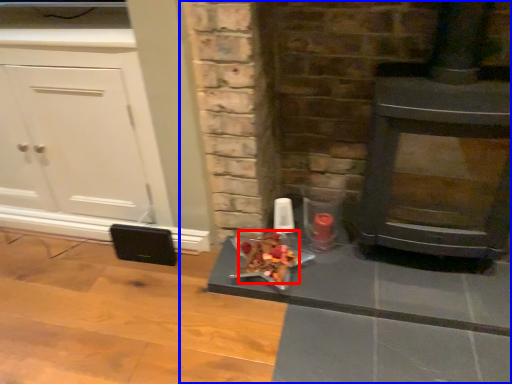
Question: Which object is closer to the camera taking this photo, food (highlighted by a red box) or fireplace (highlighted by a blue box)?

Choices:
 (A) food
 (B) fireplace

Answer: (B)